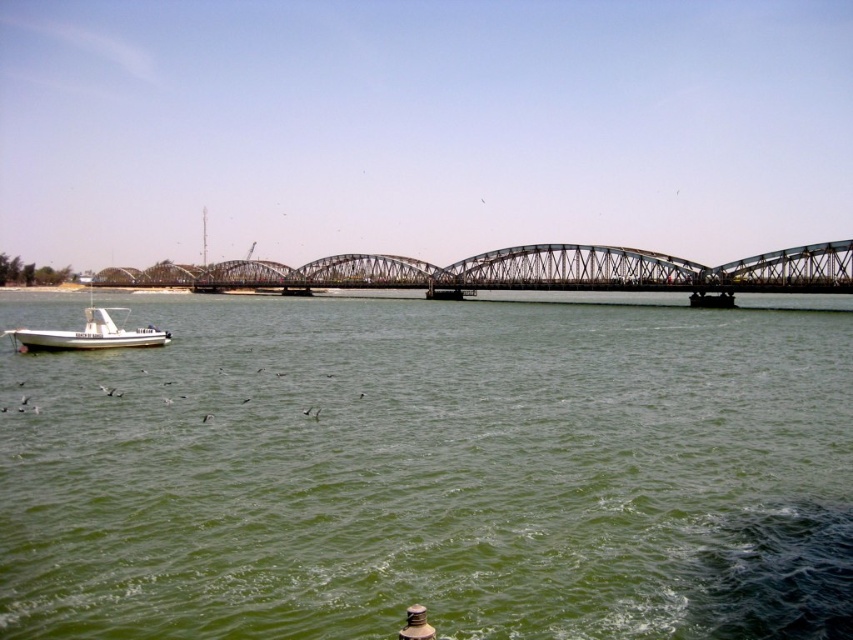
Question: Which of the following is the closest to the observer?

Choices:
 (A) white matte boat at lower left
 (B) metallic bridge at center
 (C) green water at lower center

Answer: (C)

Question: Can you confirm if green water at lower center is smaller than metallic bridge at center?

Choices:
 (A) no
 (B) yes

Answer: (B)

Question: Which point is farther to the camera?

Choices:
 (A) green water at lower center
 (B) white matte boat at lower left

Answer: (B)

Question: Based on their relative distances, which object is farther from the metallic bridge at center?

Choices:
 (A) white matte boat at lower left
 (B) green water at lower center

Answer: (B)

Question: Can you confirm if metallic bridge at center is positioned to the left of white matte boat at lower left?

Choices:
 (A) no
 (B) yes

Answer: (A)

Question: Can you confirm if green water at lower center is positioned to the right of white matte boat at lower left?

Choices:
 (A) no
 (B) yes

Answer: (B)